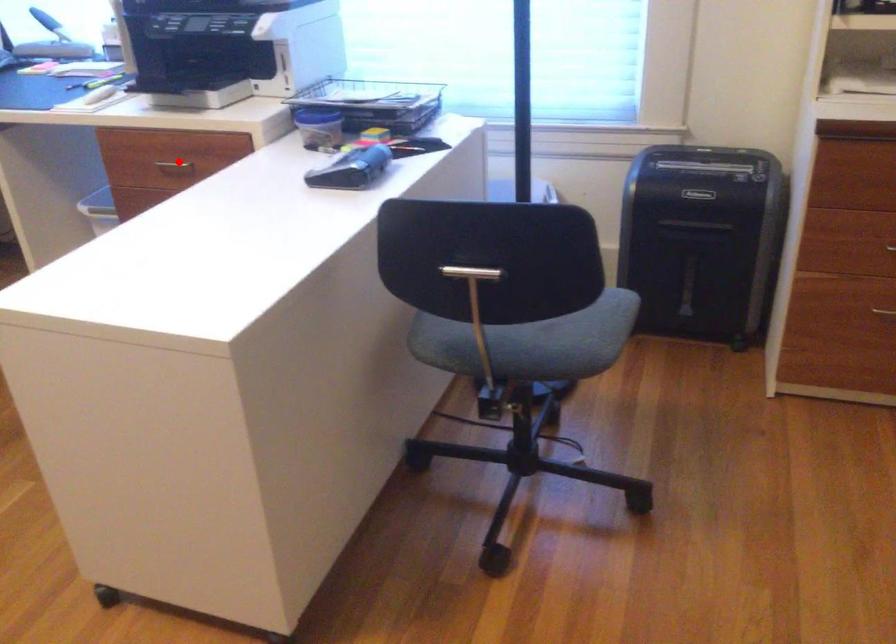
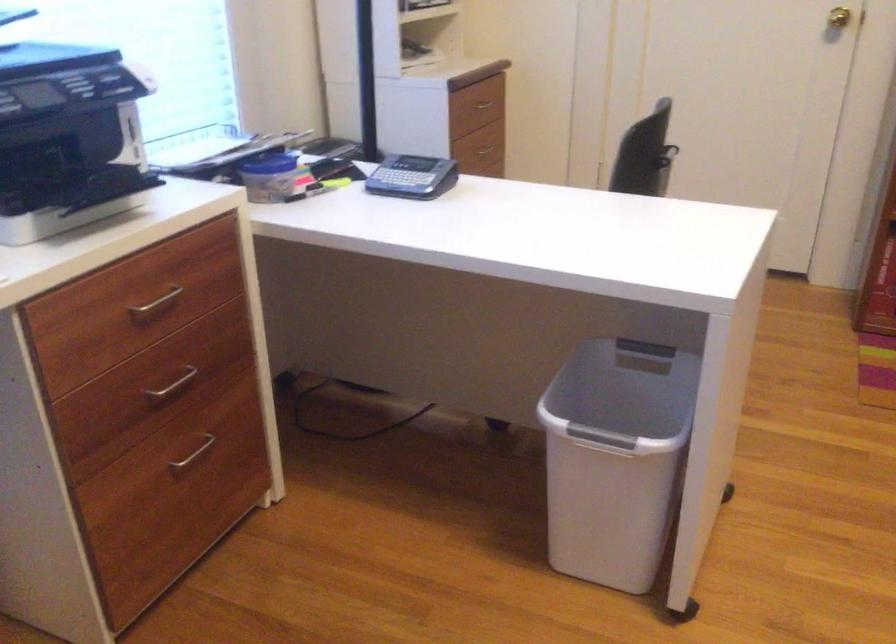
Question: A red point is marked in image1. In image2, is the corresponding 3D point closer to the camera or farther? Reply with the corresponding letter.

Choices:
 (A) The corresponding 3D point is closer.
 (B) The corresponding 3D point is farther.

Answer: (A)